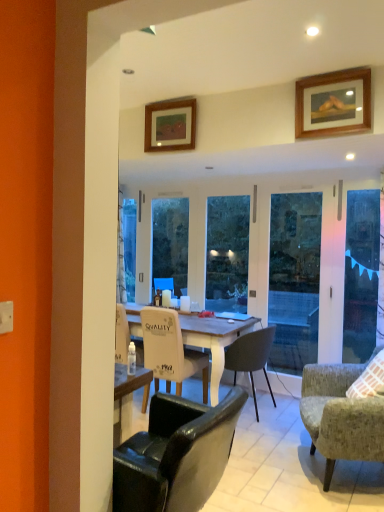
Describe the element at coordinates (131, 359) in the screenshot. Image resolution: width=384 pixels, height=512 pixels. I see `transparent plastic bottle at lower center` at that location.

The height and width of the screenshot is (512, 384). Describe the element at coordinates (170, 125) in the screenshot. I see `wooden picture frame at upper center, the first picture frame positioned from the back` at that location.

What do you see at coordinates (251, 356) in the screenshot? I see `matte black chair at center, the first chair when ordered from back to front` at bounding box center [251, 356].

Where is `textured gray armchair at lower right, placed as the third chair when sorted from back to front`? Image resolution: width=384 pixels, height=512 pixels. textured gray armchair at lower right, placed as the third chair when sorted from back to front is located at coordinates (340, 415).

Which of these two, white fabric chair at center, marked as the 2th chair in a back-to-front arrangement, or wooden picture frame at upper center, the first picture frame positioned from the back, stands taller?

With more height is white fabric chair at center, marked as the 2th chair in a back-to-front arrangement.

Is there a large distance between white fabric chair at center, arranged as the 3th chair when viewed from the front, and wooden picture frame at upper center, the first picture frame positioned from the back?

Yes, white fabric chair at center, arranged as the 3th chair when viewed from the front, is far from wooden picture frame at upper center, the first picture frame positioned from the back.

Considering the points (175, 316) and (192, 101), which point is behind, point (175, 316) or point (192, 101)?

The point (175, 316) is farther from the camera.

Is matte black chair at center, which is the 4th chair from front to back, next to textured gray armchair at lower right, placed as the third chair when sorted from back to front?

There is a gap between matte black chair at center, which is the 4th chair from front to back, and textured gray armchair at lower right, placed as the third chair when sorted from back to front.

In order to click on chair below the matte black chair at center, which is the 4th chair from front to back (from a real-world perspective) in this screenshot , I will do `click(340, 415)`.

In the scene shown: Can you confirm if matte black chair at center, the first chair when ordered from back to front, is wider than textured gray armchair at lower right, placed as the third chair when sorted from back to front?

No.

Is textured gray armchair at lower right, the second chair positioned from the front, not close to transparent glass screen door at right?

Indeed, textured gray armchair at lower right, the second chair positioned from the front, is not near transparent glass screen door at right.

Between textured gray armchair at lower right, placed as the third chair when sorted from back to front, and transparent glass screen door at right, which one has larger width?

textured gray armchair at lower right, placed as the third chair when sorted from back to front.

From their relative heights in the image, would you say textured gray armchair at lower right, placed as the third chair when sorted from back to front, is taller or shorter than transparent glass screen door at right?

In the image, textured gray armchair at lower right, placed as the third chair when sorted from back to front, appears to be shorter than transparent glass screen door at right.

Is the depth of textured gray armchair at lower right, the second chair positioned from the front, less than that of transparent glass screen door at right?

Yes, it is.

Does transparent glass screen door at right have a greater height compared to textured gray armchair at lower right, the second chair positioned from the front?

Yes, transparent glass screen door at right is taller than textured gray armchair at lower right, the second chair positioned from the front.

Is transparent glass screen door at right closer to camera compared to textured gray armchair at lower right, the second chair positioned from the front?

No, the depth of transparent glass screen door at right is greater than that of textured gray armchair at lower right, the second chair positioned from the front.

From the image's perspective, is transparent glass screen door at right under textured gray armchair at lower right, the second chair positioned from the front?

No, from the image's perspective, transparent glass screen door at right is not beneath textured gray armchair at lower right, the second chair positioned from the front.

From a real-world perspective, is transparent glass screen door at right positioned under textured gray armchair at lower right, the second chair positioned from the front, based on gravity?

No, from a real-world perspective, transparent glass screen door at right is not under textured gray armchair at lower right, the second chair positioned from the front.

Considering the sizes of objects white fabric chair at center, marked as the 2th chair in a back-to-front arrangement, and transparent glass screen door at right in the image provided, who is thinner, white fabric chair at center, marked as the 2th chair in a back-to-front arrangement, or transparent glass screen door at right?

transparent glass screen door at right.

Visually, is white fabric chair at center, arranged as the 3th chair when viewed from the front, positioned to the left or to the right of transparent glass screen door at right?

From the image, it's evident that white fabric chair at center, arranged as the 3th chair when viewed from the front, is to the left of transparent glass screen door at right.

Is transparent glass screen door at right inside white fabric chair at center, arranged as the 3th chair when viewed from the front?

No, transparent glass screen door at right is not surrounded by white fabric chair at center, arranged as the 3th chair when viewed from the front.

Which point is more forward, (195, 311) or (328, 425)?

The point (328, 425) is in front.

How distant is matte white coffee cup at center, which is the third coffee cup in left-to-right order, from textured gray armchair at lower right, placed as the third chair when sorted from back to front?

matte white coffee cup at center, which is the third coffee cup in left-to-right order, and textured gray armchair at lower right, placed as the third chair when sorted from back to front, are 1.87 meters apart from each other.

Considering the sizes of objects matte white coffee cup at center, arranged as the 1th coffee cup when viewed from the right, and textured gray armchair at lower right, the second chair positioned from the front, in the image provided, who is shorter, matte white coffee cup at center, arranged as the 1th coffee cup when viewed from the right, or textured gray armchair at lower right, the second chair positioned from the front,?

Standing shorter between the two is matte white coffee cup at center, arranged as the 1th coffee cup when viewed from the right.

From the image's perspective, is matte white coffee cup at center, which is the third coffee cup in left-to-right order, above or below textured gray armchair at lower right, the second chair positioned from the front?

From the image's perspective, matte white coffee cup at center, which is the third coffee cup in left-to-right order, appears above textured gray armchair at lower right, the second chair positioned from the front.

Considering the sizes of objects white glossy coffee cup at center, which appears as the second coffee cup when viewed from the left, and wooden picture frame at upper center, the first picture frame from the left, in the image provided, who is wider, white glossy coffee cup at center, which appears as the second coffee cup when viewed from the left, or wooden picture frame at upper center, the first picture frame from the left,?

white glossy coffee cup at center, which appears as the second coffee cup when viewed from the left, is wider.

Considering the relative sizes of white glossy coffee cup at center, which appears as the second coffee cup when viewed from the left, and wooden picture frame at upper center, placed as the second picture frame when sorted from front to back, in the image provided, is white glossy coffee cup at center, which appears as the second coffee cup when viewed from the left, shorter than wooden picture frame at upper center, placed as the second picture frame when sorted from front to back,?

Yes, white glossy coffee cup at center, which appears as the second coffee cup when viewed from the left, is shorter than wooden picture frame at upper center, placed as the second picture frame when sorted from front to back.

Does white glossy coffee cup at center, which appears as the second coffee cup when viewed from the left, contain wooden picture frame at upper center, marked as the 2th picture frame in a right-to-left arrangement?

No, wooden picture frame at upper center, marked as the 2th picture frame in a right-to-left arrangement, is located outside of white glossy coffee cup at center, which appears as the second coffee cup when viewed from the left.

The height and width of the screenshot is (512, 384). Identify the location of chair that is the 1st one when counting rightward from the wooden picture frame at upper center, placed as the second picture frame when sorted from front to back. (170, 351).

Identify the location of the 1st chair positioned above the textured gray armchair at lower right, the second chair positioned from the front (from the image's perspective). (251, 356).

Based on their spatial positions, is wooden picture frame at upper center, the first picture frame from the left, or white glossy coffee cup at center, marked as the second coffee cup in a right-to-left arrangement, closer to matte white coffee cup at center, which is the third coffee cup in left-to-right order?

Among the two, white glossy coffee cup at center, marked as the second coffee cup in a right-to-left arrangement, is located nearer to matte white coffee cup at center, which is the third coffee cup in left-to-right order.

When comparing their distances from leather-like black chair at lower center, marked as the 1th chair in a front-to-back arrangement, does transparent glass screen door at right or wooden picture frame at upper right, the first picture frame when ordered from right to left, seem closer?

wooden picture frame at upper right, the first picture frame when ordered from right to left, is positioned closer to the anchor leather-like black chair at lower center, marked as the 1th chair in a front-to-back arrangement.

Which object lies nearer to the anchor point leather-like black chair at lower center, marked as the 1th chair in a front-to-back arrangement, transparent plastic bottle at lower center or transparent glass screen door at right?

Based on the image, transparent plastic bottle at lower center appears to be nearer to leather-like black chair at lower center, marked as the 1th chair in a front-to-back arrangement.

Estimate the real-world distances between objects in this image. Which object is closer to leather-like black chair at lower center, marked as the 1th chair in a front-to-back arrangement, textured gray armchair at lower right, the second chair positioned from the front, or transparent glass screen door at right?

Based on the image, textured gray armchair at lower right, the second chair positioned from the front, appears to be nearer to leather-like black chair at lower center, marked as the 1th chair in a front-to-back arrangement.

When comparing their distances from textured gray armchair at lower right, placed as the third chair when sorted from back to front, does matte black chair at center, the first chair when ordered from back to front, or transparent plastic bottle at lower center seem closer?

Among the two, matte black chair at center, the first chair when ordered from back to front, is located nearer to textured gray armchair at lower right, placed as the third chair when sorted from back to front.

Estimate the real-world distances between objects in this image. Which object is closer to leather-like black chair at lower center, marked as the 1th chair in a front-to-back arrangement, textured gray armchair at lower right, the second chair positioned from the front, or white glossy coffee cup at center, the 3th coffee cup from the right?

textured gray armchair at lower right, the second chair positioned from the front.

From the image, which object appears to be nearer to wooden picture frame at upper center, the first picture frame from the left, white glossy coffee cup at center, which appears as the second coffee cup when viewed from the left, or transparent glass screen door at right?

Among the two, white glossy coffee cup at center, which appears as the second coffee cup when viewed from the left, is located nearer to wooden picture frame at upper center, the first picture frame from the left.

When comparing their distances from leather-like black chair at lower center, the fourth chair viewed from the back, does transparent plastic bottle at lower center or white glossy coffee cup at center, which is the first coffee cup in left-to-right order, seem further?

white glossy coffee cup at center, which is the first coffee cup in left-to-right order, lies further to leather-like black chair at lower center, the fourth chair viewed from the back, than the other object.

At what (x,y) coordinates should I click in order to perform the action: click on bottle between wooden picture frame at upper right, the 1th picture frame viewed from the front, and white fabric chair at center, arranged as the 3th chair when viewed from the front, from top to bottom. Please return your answer as a coordinate pair (x, y). This screenshot has height=512, width=384. Looking at the image, I should click on (131, 359).

At what (x,y) coordinates should I click in order to perform the action: click on coffee cup positioned between wooden picture frame at upper right, the 1th picture frame viewed from the front, and matte white coffee cup at center, arranged as the 1th coffee cup when viewed from the right, from near to far. Please return your answer as a coordinate pair (x, y). The image size is (384, 512). Looking at the image, I should click on (185, 303).

The width and height of the screenshot is (384, 512). In order to click on chair between white fabric chair at center, arranged as the 3th chair when viewed from the front, and matte white coffee cup at center, which is the third coffee cup in left-to-right order, in the front-back direction in this screenshot , I will do `click(251, 356)`.

Locate an element on the screen. This screenshot has height=512, width=384. bottle between wooden picture frame at upper right, acting as the 2th picture frame starting from the back, and textured gray armchair at lower right, placed as the third chair when sorted from back to front, from top to bottom is located at coordinates (131, 359).